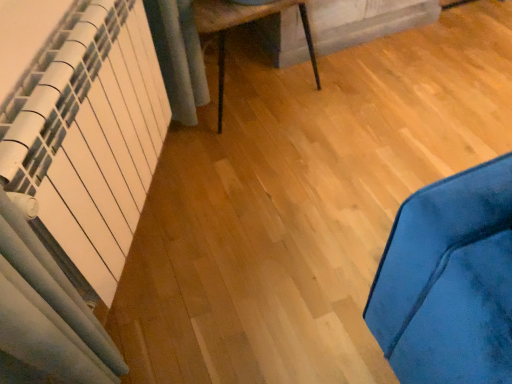
This screenshot has height=384, width=512. Identify the location of free point below white matte radiator at left (from a real-world perspective). (x=153, y=221).